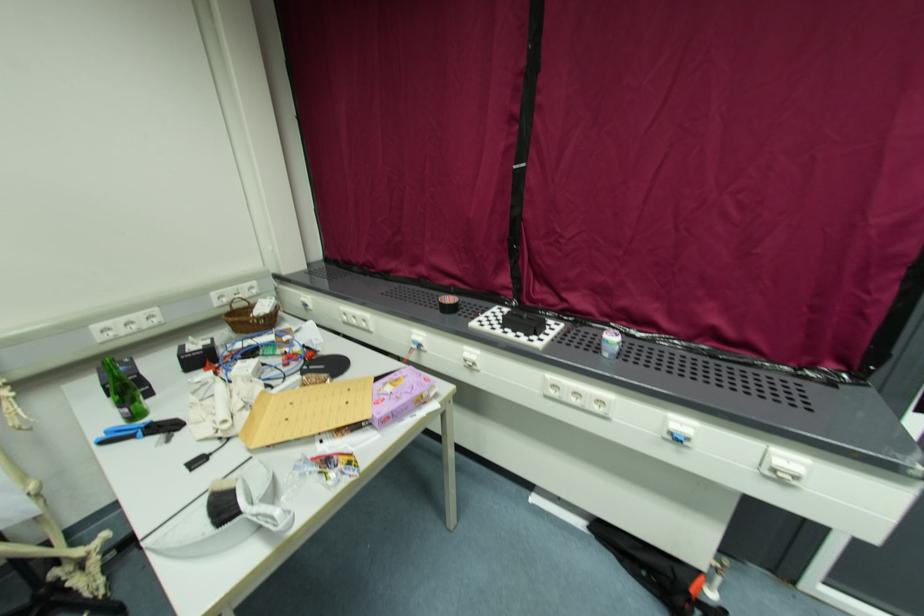
The location [399,395] corresponds to which object?

It corresponds to the purple cardboard box in the image.